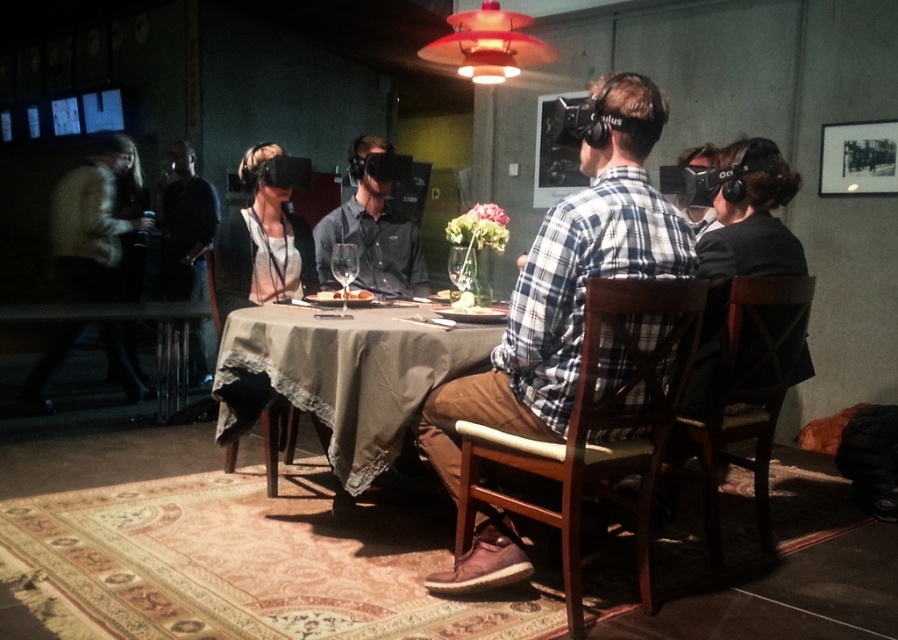
Who is more distant from viewer, (x=570, y=291) or (x=60, y=253)?

The point (x=60, y=253) is behind.

Between plaid shirt at center and light beige sweater at left, which one has more height?

light beige sweater at left

Is point (582, 336) more distant than point (72, 230)?

No.

The width and height of the screenshot is (898, 640). I want to click on plaid shirt at center, so click(568, 276).

Between point (73, 236) and point (351, 236), which one is positioned behind?

The point (73, 236) is behind.

Is light beige sweater at left positioned at the back of matte black shirt at center?

Yes.

The height and width of the screenshot is (640, 898). Find the location of `light beige sweater at left`. light beige sweater at left is located at coordinates (92, 220).

Does brown fabric table at center appear on the right side of black leather jacket at left?

Correct, you'll find brown fabric table at center to the right of black leather jacket at left.

Is point (346, 416) farther from camera compared to point (192, 269)?

That is False.

Which is behind, point (238, 355) or point (201, 193)?

Positioned behind is point (201, 193).

Find the location of a particular element. This screenshot has height=640, width=898. brown fabric table at center is located at coordinates (341, 376).